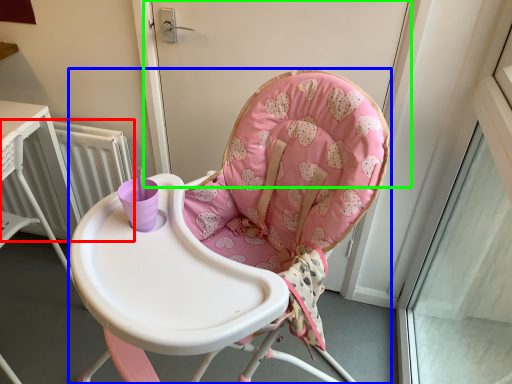
Question: Based on their relative distances, which object is nearer to radiator (highlighted by a red box)? Choose from chair (highlighted by a blue box) and screen door (highlighted by a green box).

Choices:
 (A) chair
 (B) screen door

Answer: (B)